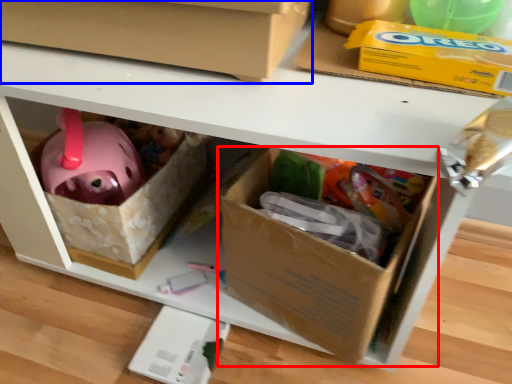
Question: Which of the following is the closest to the observer, box (highlighted by a red box) or box (highlighted by a blue box)?

Choices:
 (A) box
 (B) box

Answer: (B)